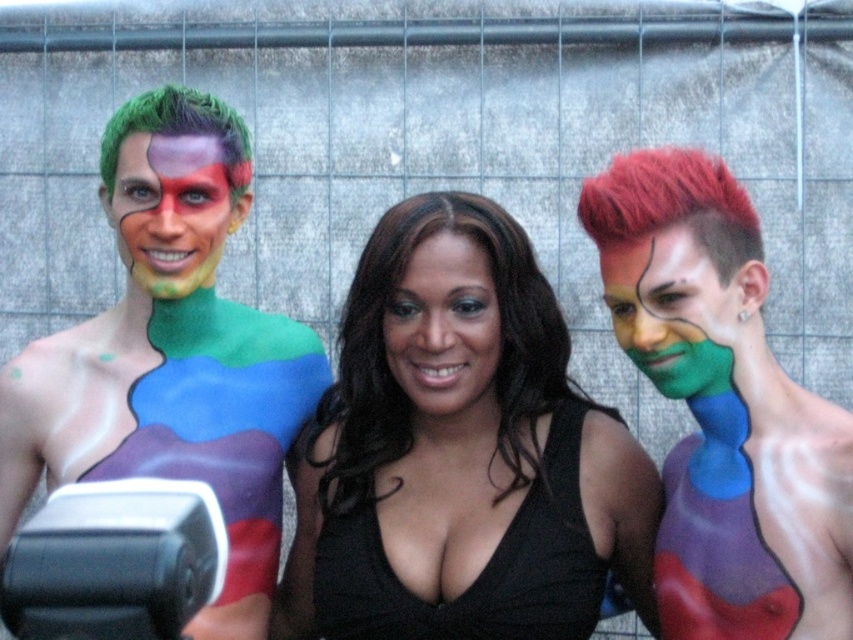
Question: Which of the following is the farthest from the observer?

Choices:
 (A) (233, 224)
 (B) (648, 244)
 (C) (502, 598)
 (D) (433, 397)

Answer: (A)

Question: Observing the image, what is the correct spatial positioning of black matte hair at center in reference to black matte dress at center?

Choices:
 (A) below
 (B) above

Answer: (B)

Question: From the image, what is the correct spatial relationship of black matte hair at center in relation to shiny red hair at right?

Choices:
 (A) below
 (B) above

Answer: (A)

Question: Does black matte dress at center have a lesser width compared to multicolored body paint at left?

Choices:
 (A) yes
 (B) no

Answer: (B)

Question: Among these points, which one is nearest to the camera?

Choices:
 (A) (189, 166)
 (B) (338, 547)
 (C) (263, 518)

Answer: (B)

Question: Considering the real-world distances, which object is closest to the smooth skin face at center?

Choices:
 (A) black matte hair at center
 (B) black matte dress at center
 (C) multicolored body paint at left
 (D) green matte body paint at right

Answer: (A)